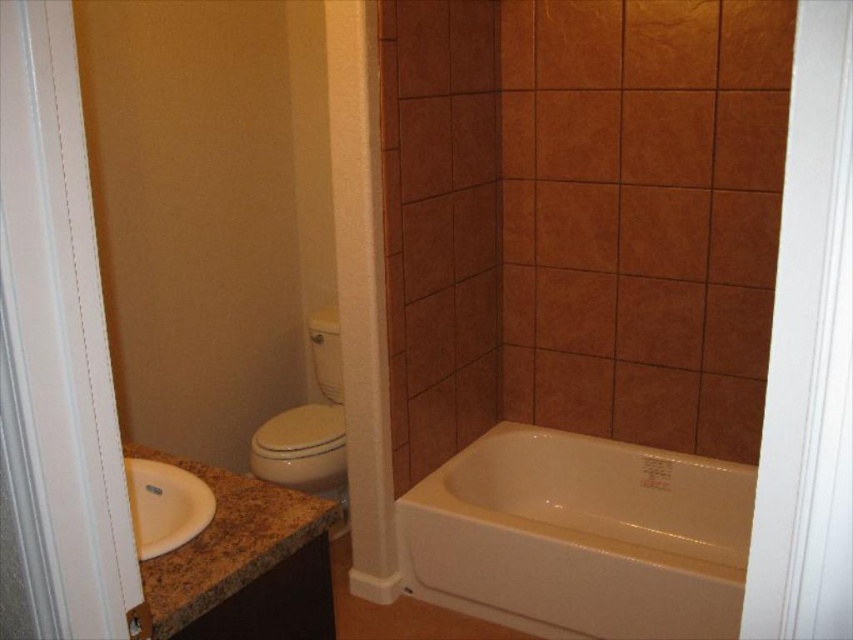
Is white glossy bathtub at lower right smaller than white glossy toilet bowl at center-left?

No.

The image size is (853, 640). Describe the element at coordinates (579, 536) in the screenshot. I see `white glossy bathtub at lower right` at that location.

Identify the location of white glossy bathtub at lower right. The image size is (853, 640). (579, 536).

Is white glossy bathtub at lower right to the left of white glossy sink at lower left from the viewer's perspective?

Incorrect, white glossy bathtub at lower right is not on the left side of white glossy sink at lower left.

Is white glossy bathtub at lower right wider than white glossy sink at lower left?

Yes, white glossy bathtub at lower right is wider than white glossy sink at lower left.

Which is behind, point (546, 609) or point (164, 540)?

Positioned behind is point (546, 609).

You are a GUI agent. You are given a task and a screenshot of the screen. Output one action in this format:
    pyautogui.click(x=<x>, y=<y>)
    Task: Click on the white glossy bathtub at lower right
    The height and width of the screenshot is (640, 853).
    Given the screenshot: What is the action you would take?
    pyautogui.click(x=579, y=536)

Looking at this image, who is positioned more to the right, white glossy toilet bowl at center-left or white glossy sink at lower left?

white glossy sink at lower left

Does white glossy toilet bowl at center-left have a lesser width compared to white glossy sink at lower left?

In fact, white glossy toilet bowl at center-left might be wider than white glossy sink at lower left.

The height and width of the screenshot is (640, 853). Find the location of `white glossy toilet bowl at center-left`. white glossy toilet bowl at center-left is located at coordinates (310, 428).